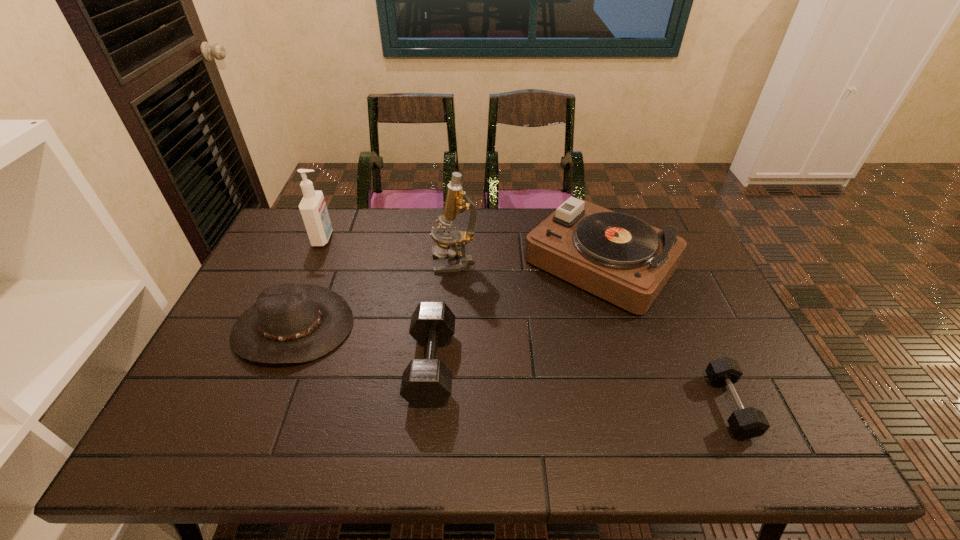
This screenshot has width=960, height=540. I want to click on free location that satisfies the following two spatial constraints: 1. on the front-facing side of the hat; 2. on the right side of the right dumbbell, so click(262, 405).

Image resolution: width=960 pixels, height=540 pixels. I want to click on vacant area in the image that satisfies the following two spatial constraints: 1. on the back side of the microscope; 2. on the front label of the second tallest object, so click(x=456, y=238).

Locate an element on the screen. vacant space that satisfies the following two spatial constraints: 1. on the front label of the tallest object; 2. on the left side of the cleansing agent is located at coordinates (314, 261).

Where is `vacant space that satisfies the following two spatial constraints: 1. on the front-facing side of the hat; 2. on the left side of the shorter dumbbell`? The image size is (960, 540). vacant space that satisfies the following two spatial constraints: 1. on the front-facing side of the hat; 2. on the left side of the shorter dumbbell is located at coordinates (262, 405).